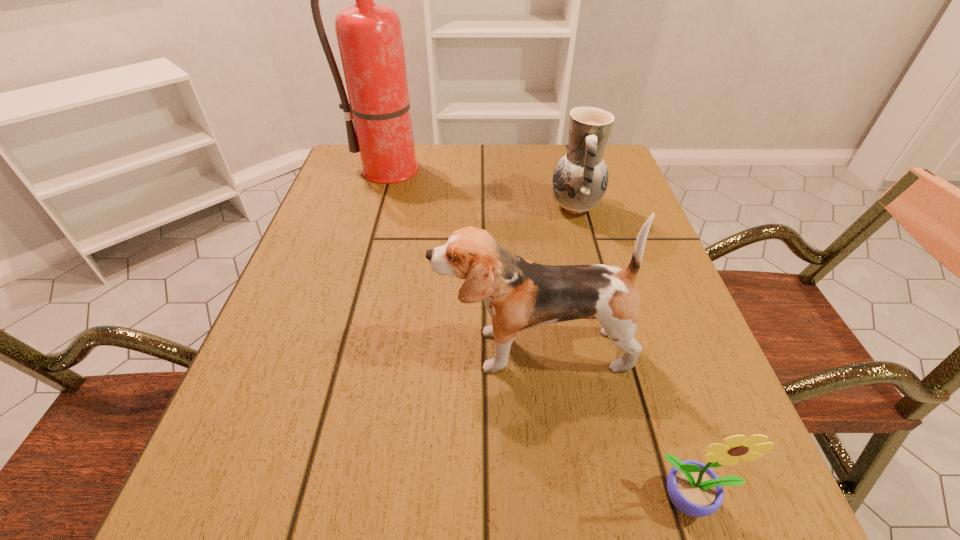
Find the location of a particular element. Image resolution: width=960 pixels, height=540 pixels. vacant region located 0.180m at the face of the second nearest object is located at coordinates (327, 350).

Image resolution: width=960 pixels, height=540 pixels. I want to click on vacant space situated at the face of the second nearest object, so [382, 350].

This screenshot has height=540, width=960. In order to click on vacant space located 0.110m on either side of the third nearest object in this screenshot , I will do `click(502, 207)`.

At what (x,y) coordinates should I click in order to perform the action: click on vacant space situated on either side of the third nearest object. Please return your answer as a coordinate pair (x, y). Looking at the image, I should click on (376, 207).

Image resolution: width=960 pixels, height=540 pixels. I want to click on free space located on either side of the third nearest object, so click(420, 207).

Locate an element on the screen. This screenshot has width=960, height=540. fire extinguisher that is at the far edge is located at coordinates (369, 35).

The height and width of the screenshot is (540, 960). Identify the location of pottery that is at the far edge. (580, 179).

The height and width of the screenshot is (540, 960). I want to click on object located at the near edge, so click(694, 488).

Locate an element on the screen. This screenshot has width=960, height=540. object that is positioned at the left edge is located at coordinates (369, 35).

You are a GUI agent. You are given a task and a screenshot of the screen. Output one action in this format:
    pyautogui.click(x=<x>, y=<y>)
    Task: Click on the puppy that is at the right edge
    
    Given the screenshot: What is the action you would take?
    pyautogui.click(x=519, y=294)